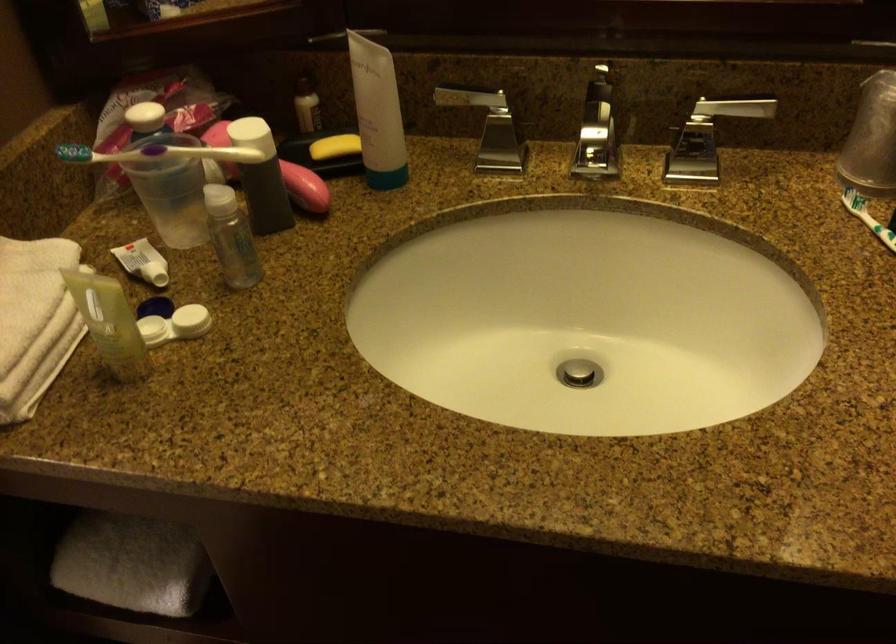
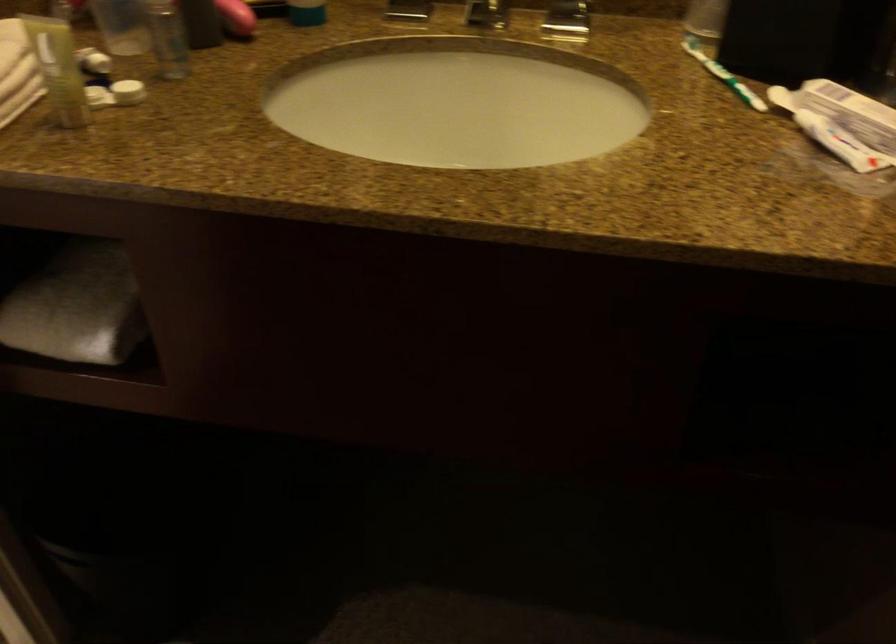
The point at [384,175] is marked in the first image. Where is the corresponding point in the second image?

(306, 13)